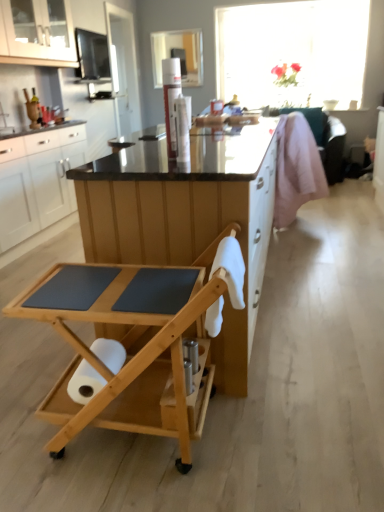
Question: Are white matte cabinet at left, which appears as the 2th cabinetry when viewed from the top, and white glossy cabinet at upper left, which is the 2th cabinetry from bottom to top, beside each other?

Choices:
 (A) no
 (B) yes

Answer: (A)

Question: Could white glossy cabinet at upper left, which is the 2th cabinetry from bottom to top, be considered to be inside white matte cabinet at left, arranged as the first cabinetry when ordered from the bottom?

Choices:
 (A) no
 (B) yes

Answer: (A)

Question: Is white matte cabinet at left, which appears as the 2th cabinetry when viewed from the top, thinner than white glossy cabinet at upper left, placed as the 1th cabinetry when sorted from top to bottom?

Choices:
 (A) yes
 (B) no

Answer: (B)

Question: Considering the relative sizes of white matte cabinet at left, arranged as the first cabinetry when ordered from the bottom, and white glossy cabinet at upper left, which is the 2th cabinetry from bottom to top, in the image provided, is white matte cabinet at left, arranged as the first cabinetry when ordered from the bottom, shorter than white glossy cabinet at upper left, which is the 2th cabinetry from bottom to top,?

Choices:
 (A) no
 (B) yes

Answer: (A)

Question: Is white matte cabinet at left, which appears as the 2th cabinetry when viewed from the top, at the right side of white glossy cabinet at upper left, placed as the 1th cabinetry when sorted from top to bottom?

Choices:
 (A) yes
 (B) no

Answer: (B)

Question: Is white matte cabinet at left, which appears as the 2th cabinetry when viewed from the top, wider or thinner than natural wood rolling cart at center?

Choices:
 (A) wide
 (B) thin

Answer: (B)

Question: In terms of height, does white matte cabinet at left, arranged as the first cabinetry when ordered from the bottom, look taller or shorter compared to natural wood rolling cart at center?

Choices:
 (A) short
 (B) tall

Answer: (B)

Question: In the image, is white matte cabinet at left, arranged as the first cabinetry when ordered from the bottom, positioned in front of or behind natural wood rolling cart at center?

Choices:
 (A) front
 (B) behind

Answer: (B)

Question: Is white matte cabinet at left, which appears as the 2th cabinetry when viewed from the top, situated inside natural wood rolling cart at center or outside?

Choices:
 (A) inside
 (B) outside

Answer: (B)

Question: From their relative heights in the image, would you say pink fabric swivel chair at right is taller or shorter than wooden rolling cart at center?

Choices:
 (A) short
 (B) tall

Answer: (B)

Question: From a real-world perspective, relative to wooden rolling cart at center, is pink fabric swivel chair at right vertically above or below?

Choices:
 (A) above
 (B) below

Answer: (B)

Question: In the image, is pink fabric swivel chair at right positioned in front of or behind wooden rolling cart at center?

Choices:
 (A) behind
 (B) front

Answer: (A)

Question: In terms of width, does pink fabric swivel chair at right look wider or thinner when compared to wooden rolling cart at center?

Choices:
 (A) wide
 (B) thin

Answer: (B)

Question: From the image's perspective, is transparent glass vase at upper center located above or below wooden rolling cart at center?

Choices:
 (A) below
 (B) above

Answer: (B)

Question: Is point (228, 29) closer or farther from the camera than point (264, 247)?

Choices:
 (A) closer
 (B) farther

Answer: (B)